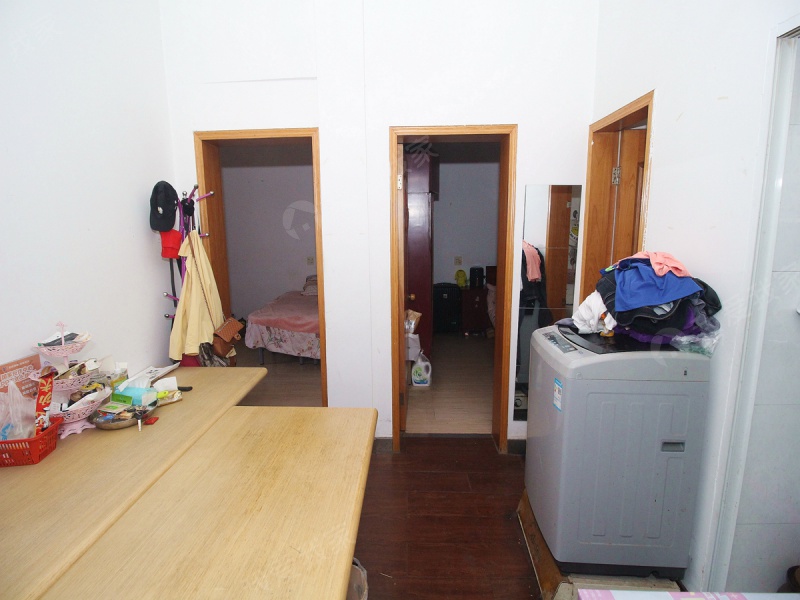
I want to click on pile of clothing, so click(649, 289).